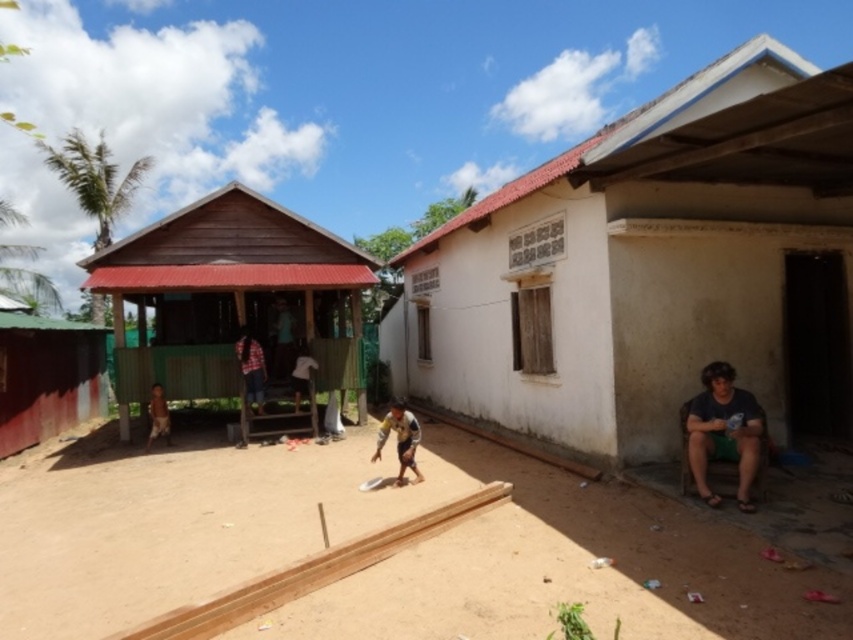
Is rusty corrugated metal hut at left to the left of brown furry dog at lower left from the viewer's perspective?

Indeed, rusty corrugated metal hut at left is positioned on the left side of brown furry dog at lower left.

Who is more distant from viewer, (18, 413) or (149, 400)?

Positioned behind is point (18, 413).

Locate an element on the screen. rusty corrugated metal hut at left is located at coordinates (47, 378).

Between point (25, 321) and point (734, 435), which one is positioned in front?

Point (734, 435) is in front.

Between point (103, 404) and point (747, 472), which one is positioned behind?

The point (103, 404) is more distant.

Find the location of a particular element. This screenshot has height=640, width=853. rusty corrugated metal hut at left is located at coordinates (47, 378).

Find the location of a particular element. The image size is (853, 640). dark blue fabric at lower right is located at coordinates (723, 432).

Can you confirm if dark blue fabric at lower right is taller than brown furry dog at lower left?

Yes.

Image resolution: width=853 pixels, height=640 pixels. Describe the element at coordinates (723, 432) in the screenshot. I see `dark blue fabric at lower right` at that location.

Where is `dark blue fabric at lower right`? dark blue fabric at lower right is located at coordinates (723, 432).